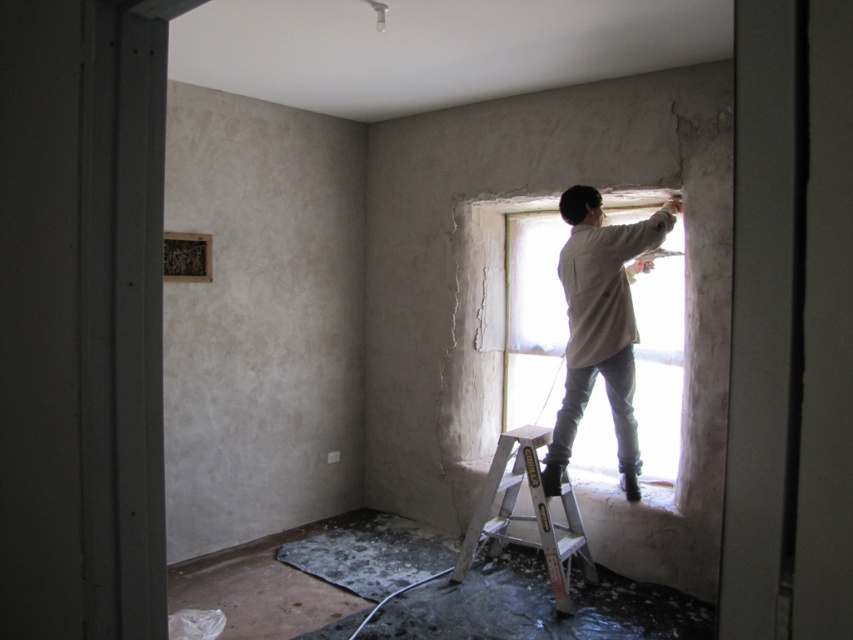
Question: Which point appears closest to the camera in this image?

Choices:
 (A) (595, 572)
 (B) (631, 240)

Answer: (B)

Question: Is light brown cotton shirt at upper right smaller than silver metallic ladder at center?

Choices:
 (A) no
 (B) yes

Answer: (A)

Question: Can you confirm if light brown cotton shirt at upper right is wider than silver metallic ladder at center?

Choices:
 (A) yes
 (B) no

Answer: (B)

Question: Which point is closer to the camera taking this photo?

Choices:
 (A) (631, 336)
 (B) (556, 534)

Answer: (A)

Question: Is light brown cotton shirt at upper right thinner than silver metallic ladder at center?

Choices:
 (A) no
 (B) yes

Answer: (B)